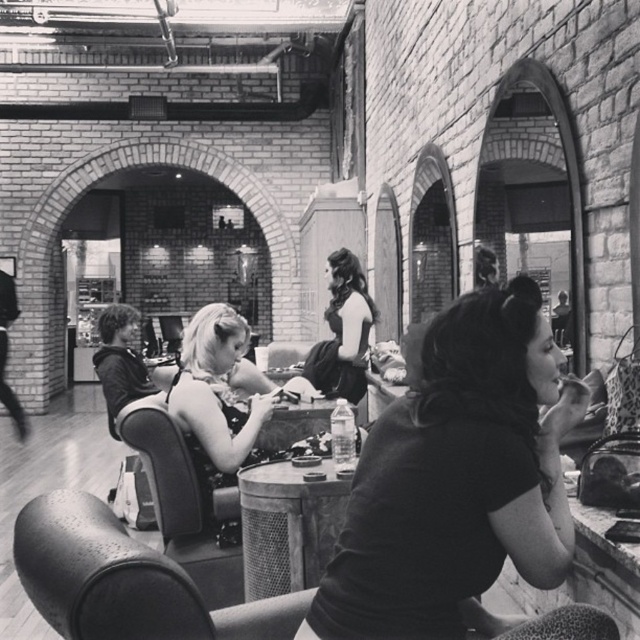
You are standing in the salon and need to locate the matte black shirt at center. According to the coordinates provided, where should you look relative to the center of the image?

The matte black shirt at center is located at coordinates point [458,481], which means it is slightly to the right and slightly below the center of the image.

You are standing in the salon and want to take a closer look at the two points marked in the image. Which point, point (486, 384) or point (332, 252), is nearer to you?

Point (486, 384) is closer to the camera than point (332, 252), so it is nearer to you.

You are standing in the salon and want to place a small potted plant between the two points labeled point (448, 456) and point (186, 394). Which point should the plant be closer to so that it appears larger in the image?

The plant should be placed closer to point (448, 456) because it is closer to the viewer than point (186, 394), so objects near it will appear larger in the image.